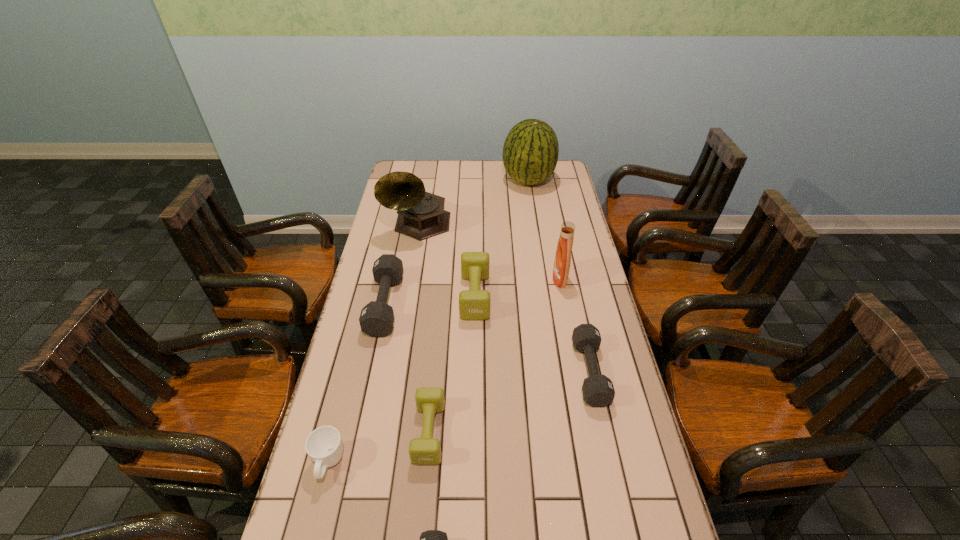
The height and width of the screenshot is (540, 960). Identify the location of dumbbell identified as the second closest to the rightmost gray dumbbell. (426, 450).

This screenshot has height=540, width=960. What are the coordinates of `the fourth closest dumbbell relative to the phonograph record` in the screenshot? It's located at (426, 450).

Where is `gray dumbbell that is the second closest to the rightmost dumbbell`? gray dumbbell that is the second closest to the rightmost dumbbell is located at coordinates (376, 319).

Identify which gray dumbbell is the closest to the nearest gray dumbbell. Please provide its 2D coordinates. Your answer should be formatted as a tuple, i.e. [(x, y)], where the tuple contains the x and y coordinates of a point satisfying the conditions above.

[(598, 391)]

Where is `vacant region that satisfies the following two spatial constraints: 1. on the horn direction of the second farthest object; 2. on the left side of the smaller olive dumbbell`? The width and height of the screenshot is (960, 540). vacant region that satisfies the following two spatial constraints: 1. on the horn direction of the second farthest object; 2. on the left side of the smaller olive dumbbell is located at coordinates (382, 433).

The image size is (960, 540). I want to click on vacant region that satisfies the following two spatial constraints: 1. on the front-facing side of the detergent; 2. on the front side of the biggest gray dumbbell, so click(564, 304).